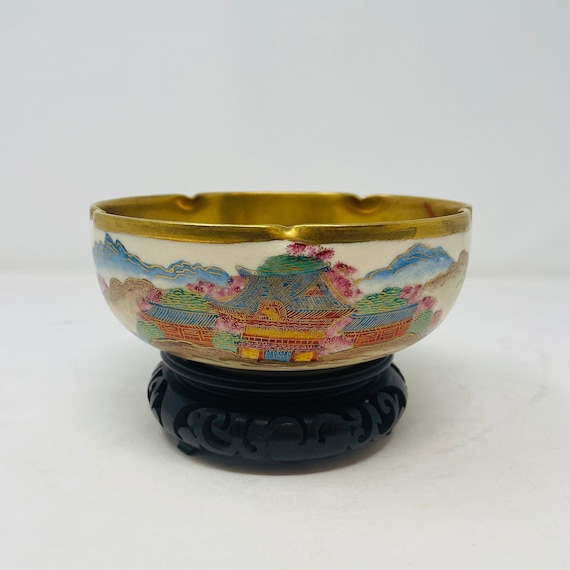
Identify the location of empty space left of bowl. The height and width of the screenshot is (570, 570). (40, 317).